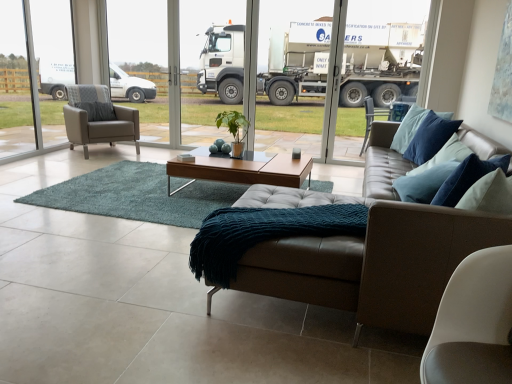
In order to click on brown leather couch at center in this screenshot , I will do `click(369, 258)`.

Where is `white glossy truck at upper center`? This screenshot has width=512, height=384. white glossy truck at upper center is located at coordinates (219, 67).

This screenshot has height=384, width=512. I want to click on teal knitted blanket at center, so coord(264,233).

Measure the distance between teal knitted blanket at center and camera.

They are 1.82 meters apart.

At what (x,y) coordinates should I click in order to perform the action: click on light brown wood coffee table at center. Please return your answer as a coordinate pair (x, y). The image size is (512, 384). Looking at the image, I should click on (242, 169).

This screenshot has height=384, width=512. I want to click on brown leather couch at center, so click(x=369, y=258).

Can you confirm if teal knitted blanket at center is positioned to the left of matte gray armchair at left?

No.

Does teal knitted blanket at center turn towards matte gray armchair at left?

No, teal knitted blanket at center is not oriented towards matte gray armchair at left.

Between teal knitted blanket at center and matte gray armchair at left, which one has larger size?

matte gray armchair at left.

From the image's perspective, relative to matte gray armchair at left, is teal knitted blanket at center above or below?

From the image's perspective, teal knitted blanket at center appears below matte gray armchair at left.

Considering the relative sizes of teal knitted blanket at center and matte gray armchair at left in the image provided, is teal knitted blanket at center wider than matte gray armchair at left?

Indeed, teal knitted blanket at center has a greater width compared to matte gray armchair at left.

From the picture: Considering the sizes of teal knitted blanket at center and matte gray armchair at left in the image, is teal knitted blanket at center taller or shorter than matte gray armchair at left?

Considering their sizes, teal knitted blanket at center has less height than matte gray armchair at left.

Can you confirm if teal knitted blanket at center is smaller than matte gray armchair at left?

Correct, teal knitted blanket at center occupies less space than matte gray armchair at left.

From the image's perspective, which one is positioned higher, matte gray armchair at left or matte gray armchair at left?

From the image's view, matte gray armchair at left is above.

From a real-world perspective, relative to matte gray armchair at left, is matte gray armchair at left vertically above or below?

From a real-world perspective, matte gray armchair at left is physically below matte gray armchair at left.

Considering the relative positions of matte gray armchair at left and matte gray armchair at left in the image provided, is matte gray armchair at left to the left of matte gray armchair at left from the viewer's perspective?

No, matte gray armchair at left is not to the left of matte gray armchair at left.

Is matte gray armchair at left beside matte gray armchair at left?

No, matte gray armchair at left is not beside matte gray armchair at left.

Does matte gray armchair at left have a lesser height compared to white glossy truck at upper center?

Yes.

Is matte gray armchair at left positioned beyond the bounds of white glossy truck at upper center?

matte gray armchair at left lies outside white glossy truck at upper center's area.

Is matte gray armchair at left facing away from white glossy truck at upper center?

No.

I want to click on screen door behind the brown leather couch at center, so click(219, 67).

Can you confirm if white glossy truck at upper center is shorter than brown leather couch at center?

No, white glossy truck at upper center is not shorter than brown leather couch at center.

In the scene shown: Is white glossy truck at upper center behind brown leather couch at center?

That is True.

Based on the photo, from the image's perspective, is white glossy truck at upper center over brown leather couch at center?

Correct, white glossy truck at upper center appears higher than brown leather couch at center in the image.

Does point (41, 92) appear closer or farther from the camera than point (255, 174)?

Point (41, 92) is farther from the camera than point (255, 174).

Considering the relative positions of matte gray armchair at left and light brown wood coffee table at center in the image provided, is matte gray armchair at left to the left or to the right of light brown wood coffee table at center?

In the image, matte gray armchair at left appears on the left side of light brown wood coffee table at center.

In order to click on window screen above the light brown wood coffee table at center (from the image's perspective) in this screenshot , I will do `click(51, 44)`.

Considering the sizes of matte gray armchair at left and light brown wood coffee table at center in the image, is matte gray armchair at left wider or thinner than light brown wood coffee table at center?

matte gray armchair at left is thinner than light brown wood coffee table at center.

From the image's perspective, which one is positioned higher, light brown wood coffee table at center or brown leather couch at center?

light brown wood coffee table at center.

Is light brown wood coffee table at center spatially inside brown leather couch at center, or outside of it?

light brown wood coffee table at center is not enclosed by brown leather couch at center.

Considering the points (302, 157) and (469, 134), which point is in front, point (302, 157) or point (469, 134)?

Point (469, 134)

The width and height of the screenshot is (512, 384). Identify the location of chair on the left of teal knitted blanket at center. (98, 118).

Where is `blanket directly beneath the matte gray armchair at left (from a real-world perspective)`? This screenshot has width=512, height=384. blanket directly beneath the matte gray armchair at left (from a real-world perspective) is located at coordinates (264, 233).

From the image, which object appears to be nearer to white glossy truck at upper center, teal knitted blanket at center or brown leather couch at center?

teal knitted blanket at center lies closer to white glossy truck at upper center than the other object.

From the picture: From the image, which object appears to be nearer to teal knitted blanket at center, matte gray armchair at left or matte gray armchair at left?

matte gray armchair at left is closer to teal knitted blanket at center.

Considering their positions, is matte gray armchair at left positioned further to light brown wood coffee table at center than white glossy truck at upper center?

Among the two, white glossy truck at upper center is located further to light brown wood coffee table at center.

Based on their spatial positions, is white glossy truck at upper center or matte gray armchair at left further from light brown wood coffee table at center?

Among the two, white glossy truck at upper center is located further to light brown wood coffee table at center.

Based on their spatial positions, is white glossy truck at upper center or brown leather couch at center closer to matte gray armchair at left?

brown leather couch at center is closer to matte gray armchair at left.

Looking at the image, which one is located closer to light brown wood coffee table at center, teal knitted blanket at center or white glossy truck at upper center?

teal knitted blanket at center is positioned closer to the anchor light brown wood coffee table at center.

From the image, which object appears to be farther from matte gray armchair at left, light brown wood coffee table at center or brown leather couch at center?

brown leather couch at center is positioned further to the anchor matte gray armchair at left.

Consider the image. When comparing their distances from light brown wood coffee table at center, does brown leather couch at center or matte gray armchair at left seem closer?

Based on the image, brown leather couch at center appears to be nearer to light brown wood coffee table at center.

Locate an element on the screen. chair between matte gray armchair at left and white glossy truck at upper center from left to right is located at coordinates (98, 118).

Identify the location of blanket between matte gray armchair at left and brown leather couch at center in the horizontal direction. Image resolution: width=512 pixels, height=384 pixels. (264, 233).

Find the location of a particular element. This screenshot has width=512, height=384. chair between matte gray armchair at left and brown leather couch at center is located at coordinates (98, 118).

Where is `blanket located between brown leather couch at center and white glossy truck at upper center in the depth direction`? This screenshot has width=512, height=384. blanket located between brown leather couch at center and white glossy truck at upper center in the depth direction is located at coordinates (264, 233).